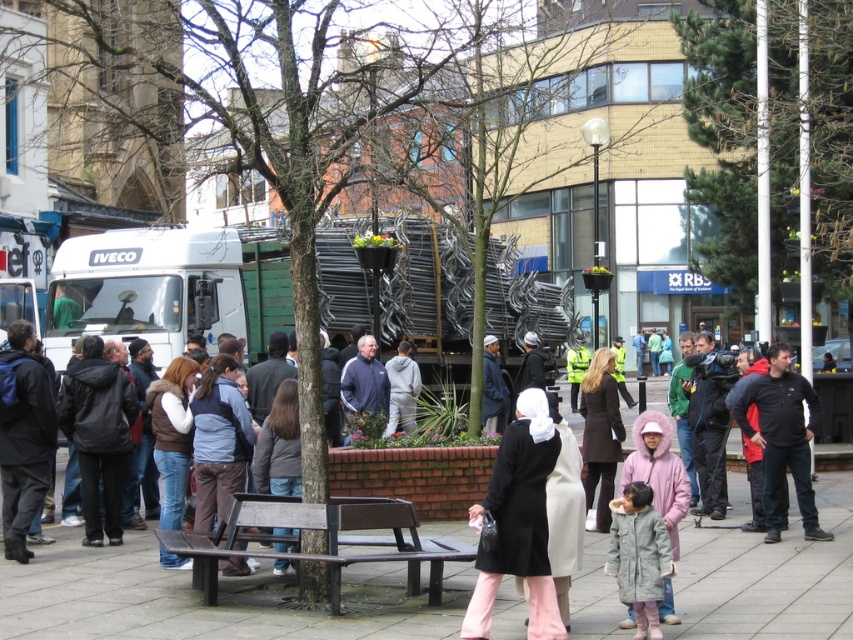
You are a delivery person who needs to place a package on the smooth concrete pavement at center and the wooden bench at center. Which surface can you use if you want to place the package higher up?

The wooden bench at center is taller than the smooth concrete pavement at center, so you should place the package on the wooden bench at center.

Based on the scene description, where is the point located at coordinates (200, 598)?

The point at coordinates (200, 598) is located on the smooth concrete pavement at center.

Based on the photo, you are a delivery person who needs to place a heavy box on the smooth concrete pavement at center. However, there is a wooden bench at center in the way. Can you move the bench to access the pavement?

The smooth concrete pavement at center is below the wooden bench at center, so you can simply move the wooden bench at center to access the smooth concrete pavement at center.